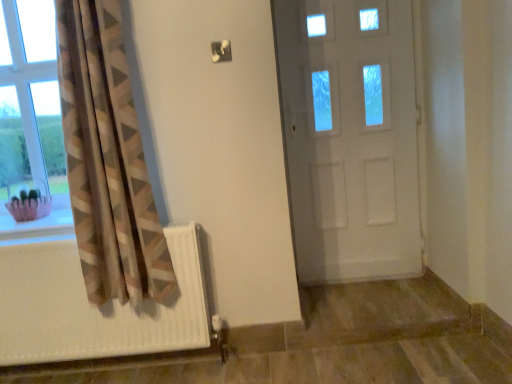
Question: Does clear glass window at left come in front of white glossy door at center?

Choices:
 (A) yes
 (B) no

Answer: (A)

Question: Can you confirm if clear glass window at left is positioned to the left of white glossy door at center?

Choices:
 (A) no
 (B) yes

Answer: (B)

Question: Is clear glass window at left placed right next to white glossy door at center?

Choices:
 (A) no
 (B) yes

Answer: (A)

Question: From a real-world perspective, is clear glass window at left under white glossy door at center?

Choices:
 (A) yes
 (B) no

Answer: (B)

Question: Is clear glass window at left smaller than white glossy door at center?

Choices:
 (A) no
 (B) yes

Answer: (B)

Question: From a real-world perspective, is clear glass window at left physically located above or below white matte radiator at lower left?

Choices:
 (A) above
 (B) below

Answer: (A)

Question: Based on their sizes in the image, would you say clear glass window at left is bigger or smaller than white matte radiator at lower left?

Choices:
 (A) small
 (B) big

Answer: (A)

Question: From the image's perspective, is clear glass window at left positioned above or below white matte radiator at lower left?

Choices:
 (A) below
 (B) above

Answer: (B)

Question: Relative to white matte radiator at lower left, is clear glass window at left in front or behind?

Choices:
 (A) front
 (B) behind

Answer: (B)

Question: From their relative heights in the image, would you say neutral fabric curtain at left is taller or shorter than white glossy door at center?

Choices:
 (A) short
 (B) tall

Answer: (A)

Question: Is neutral fabric curtain at left spatially inside white glossy door at center, or outside of it?

Choices:
 (A) outside
 (B) inside

Answer: (A)

Question: Does point (74, 86) appear closer or farther from the camera than point (393, 266)?

Choices:
 (A) farther
 (B) closer

Answer: (B)

Question: Looking at their shapes, would you say neutral fabric curtain at left is wider or thinner than white glossy door at center?

Choices:
 (A) wide
 (B) thin

Answer: (A)

Question: Based on their positions, is white matte radiator at lower left located to the left or right of pink fabric basket at lower left?

Choices:
 (A) right
 (B) left

Answer: (A)

Question: From a real-world perspective, is white matte radiator at lower left physically located above or below pink fabric basket at lower left?

Choices:
 (A) below
 (B) above

Answer: (A)